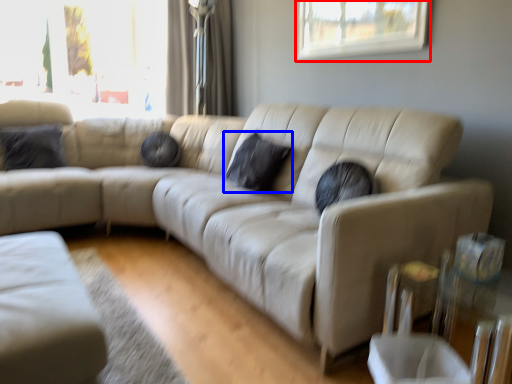
Question: Which point is closer to the camera, window (highlighted by a red box) or pillow (highlighted by a blue box)?

Choices:
 (A) window
 (B) pillow

Answer: (A)